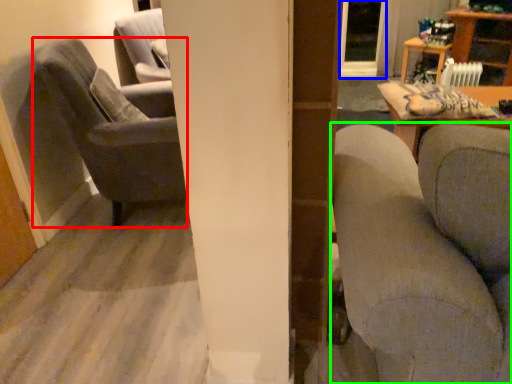
Question: Considering the real-world distances, which object is farthest from chair (highlighted by a red box)? glass door (highlighted by a blue box) or studio couch (highlighted by a green box)?

Choices:
 (A) glass door
 (B) studio couch

Answer: (A)